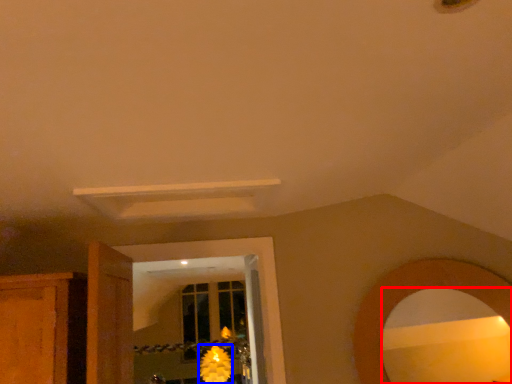
Question: Which object appears closest to the camera in this image, mirror (highlighted by a red box) or flower (highlighted by a blue box)?

Choices:
 (A) mirror
 (B) flower

Answer: (A)